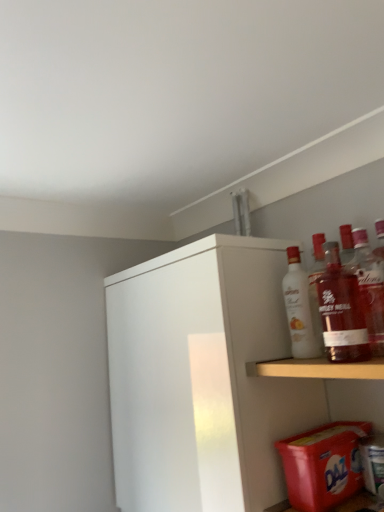
Question: Considering the positions of translucent glass bottle at upper right, marked as the first bottle in a front-to-back arrangement, and red plastic laundry detergent at lower right in the image, is translucent glass bottle at upper right, marked as the first bottle in a front-to-back arrangement, taller or shorter than red plastic laundry detergent at lower right?

Choices:
 (A) short
 (B) tall

Answer: (B)

Question: Considering the positions of translucent glass bottle at upper right, the second bottle viewed from the left, and red plastic laundry detergent at lower right in the image, is translucent glass bottle at upper right, the second bottle viewed from the left, bigger or smaller than red plastic laundry detergent at lower right?

Choices:
 (A) small
 (B) big

Answer: (A)

Question: Which of these objects is positioned closest to the white glossy bottle at upper right, positioned as the 1th bottle in left-to-right order?

Choices:
 (A) red plastic laundry detergent at lower right
 (B) translucent glass bottle at shelf right
 (C) white matte cabinet at upper right
 (D) translucent glass bottle at upper right, marked as the first bottle in a front-to-back arrangement

Answer: (B)

Question: Considering the real-world distances, which object is farthest from the white glossy bottle at upper right, which is the 2th bottle from front to back?

Choices:
 (A) white matte cabinet at upper right
 (B) translucent glass bottle at upper right, which is the second bottle from back to front
 (C) translucent glass bottle at shelf right
 (D) red plastic laundry detergent at lower right

Answer: (A)